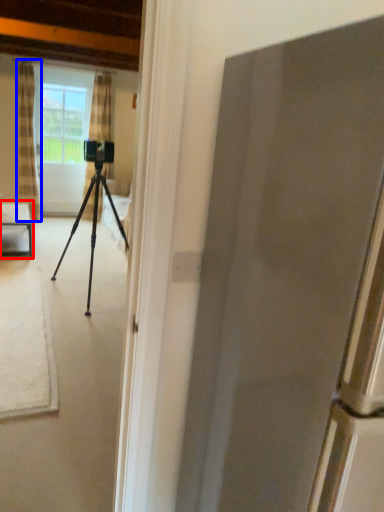
Question: Which object is further to the camera taking this photo, table (highlighted by a red box) or curtain (highlighted by a blue box)?

Choices:
 (A) table
 (B) curtain

Answer: (B)